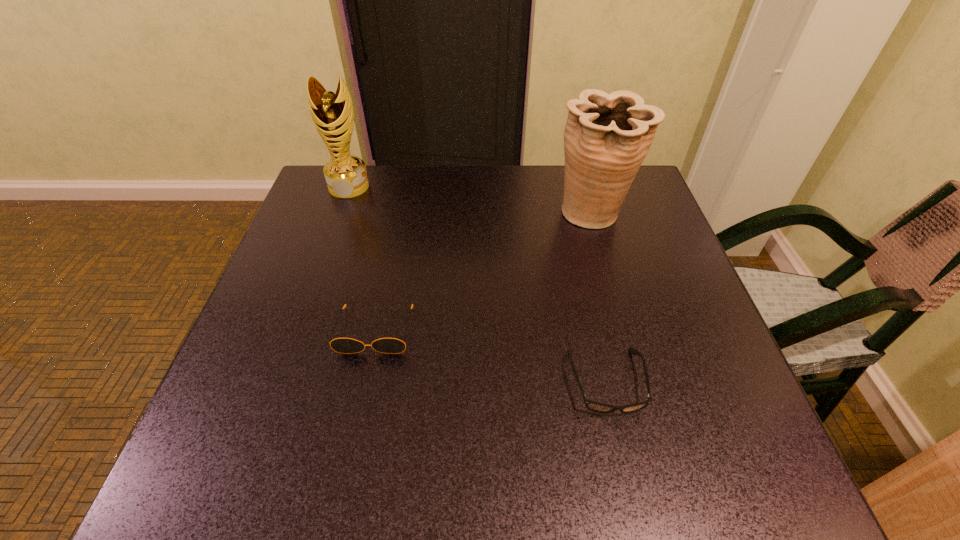
Locate an element on the screen. The image size is (960, 540). urn present at the far edge is located at coordinates (607, 136).

I want to click on object at the left edge, so click(x=332, y=113).

Identify the location of urn that is at the right edge. (607, 136).

Locate an element on the screen. spectacles at the right edge is located at coordinates (594, 406).

Where is `object that is at the far left corner`? This screenshot has width=960, height=540. object that is at the far left corner is located at coordinates (332, 113).

The height and width of the screenshot is (540, 960). Find the location of `object located in the far right corner section of the desktop`. object located in the far right corner section of the desktop is located at coordinates (607, 136).

You are a GUI agent. You are given a task and a screenshot of the screen. Output one action in this format:
    pyautogui.click(x=<x>, y=<y>)
    Task: Click on the vacant space at the far edge
    The width and height of the screenshot is (960, 540).
    Given the screenshot: What is the action you would take?
    pyautogui.click(x=435, y=179)

Where is `vacant space at the near edge of the desktop`? This screenshot has width=960, height=540. vacant space at the near edge of the desktop is located at coordinates (492, 447).

In order to click on free space at the left edge of the desktop in this screenshot , I will do (213, 407).

In the image, there is a desktop. Where is `free space at the right edge`? free space at the right edge is located at coordinates (645, 354).